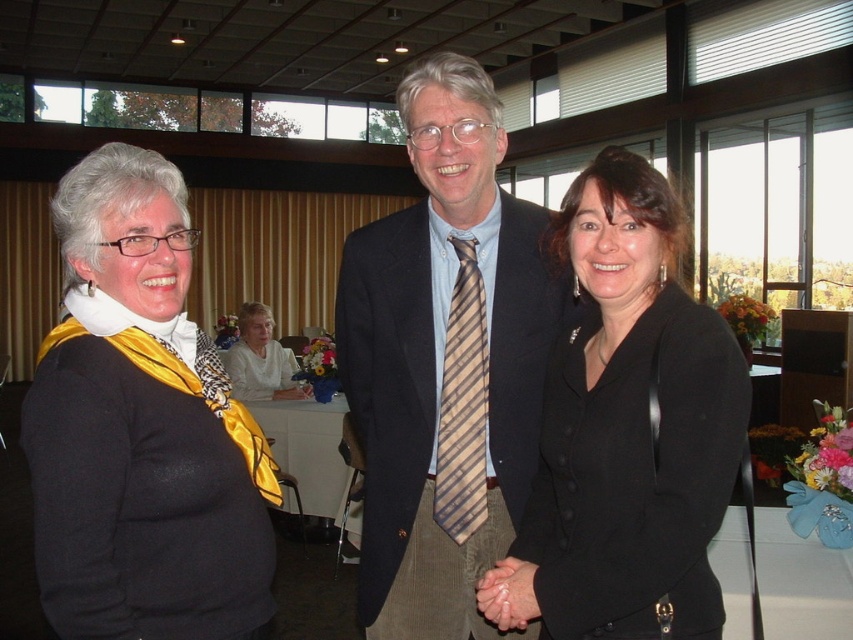
You are a photographer at a formal event. You need to capture a closeup shot of both the black matte scarf at left and the brown striped tie at center. Can you fit both in the frame if your camera has a maximum field of view of 22 inches?

The black matte scarf at left and brown striped tie at center are 22.41 inches apart. Since the distance between them exceeds the camera field of view of 22 inches, you cannot fit both in the frame.

Based on the scene description, where is the striped tie at center located in terms of coordinates?

The striped tie at center is located at coordinates point (444, 362).